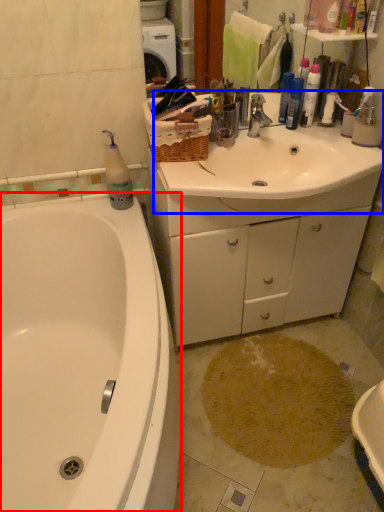
Question: Which point is further to the camera, bathtub (highlighted by a red box) or sink (highlighted by a blue box)?

Choices:
 (A) bathtub
 (B) sink

Answer: (B)